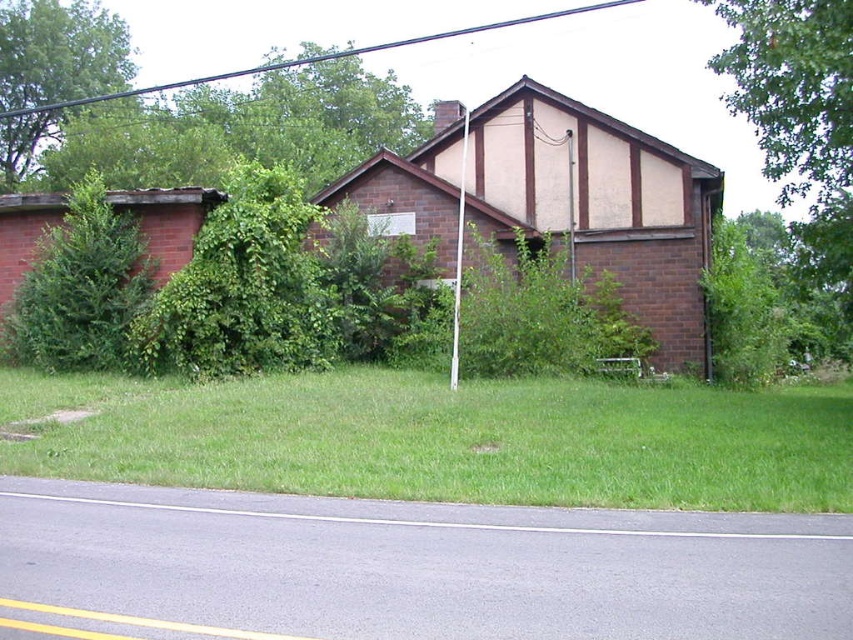
Question: Which of the following is the closest to the observer?

Choices:
 (A) green grass at lower center
 (B) green leafy tree at left

Answer: (A)

Question: Is the position of green grass at lower center more distant than that of green leafy tree at upper left?

Choices:
 (A) no
 (B) yes

Answer: (A)

Question: Which point appears closest to the camera in this image?

Choices:
 (A) (30, 116)
 (B) (55, 358)

Answer: (B)

Question: Observing the image, what is the correct spatial positioning of green leafy tree at left in reference to green leafy tree at upper left?

Choices:
 (A) left
 (B) right

Answer: (B)

Question: Does green leafy tree at left come behind green leafy tree at upper left?

Choices:
 (A) yes
 (B) no

Answer: (B)

Question: Which point appears farthest from the camera in this image?

Choices:
 (A) (21, 36)
 (B) (123, 257)

Answer: (A)